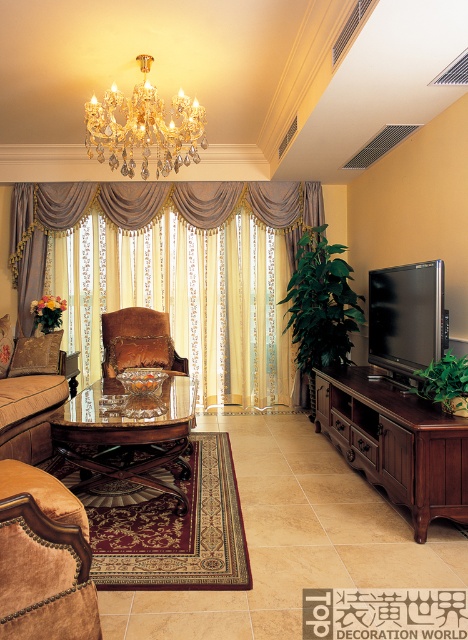
Question: From the image, what is the correct spatial relationship of velvet tan chair at lower left in relation to gold crystal chandelier at upper center?

Choices:
 (A) right
 (B) left

Answer: (B)

Question: Is silky beige curtain at center wider than gold crystal chandelier at upper center?

Choices:
 (A) no
 (B) yes

Answer: (B)

Question: Which object is closer to the camera taking this photo?

Choices:
 (A) gold crystal chandelier at upper center
 (B) velvet tan chair at lower left
 (C) velvet brown chair at center

Answer: (B)

Question: Among these objects, which one is farthest from the camera?

Choices:
 (A) velvet brown chair at center
 (B) gold crystal chandelier at upper center
 (C) velvet tan chair at lower left
 (D) brown wood tv stand at right

Answer: (A)

Question: Estimate the real-world distances between objects in this image. Which object is farther from the suede couch at left?

Choices:
 (A) velvet tan chair at lower left
 (B) velvet brown chair at center
 (C) brown wood tv stand at right

Answer: (C)

Question: Can you confirm if velvet tan chair at lower left is wider than velvet brown chair at center?

Choices:
 (A) yes
 (B) no

Answer: (B)